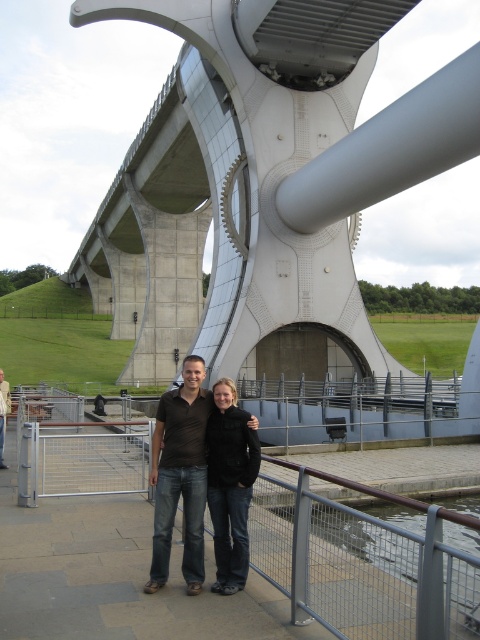
Is metallic gray bridge at center wider than black leather jacket at center?

Indeed, metallic gray bridge at center has a greater width compared to black leather jacket at center.

Who is more distant from viewer, (453, 122) or (247, 445)?

Positioned behind is point (453, 122).

Where is `metallic gray bridge at center`? Image resolution: width=480 pixels, height=640 pixels. metallic gray bridge at center is located at coordinates (x=265, y=176).

Between brown cotton shirt at center and brown shirt at center, which one has more height?

Standing taller between the two is brown cotton shirt at center.

Does brown cotton shirt at center have a lesser width compared to brown shirt at center?

Yes, brown cotton shirt at center is thinner than brown shirt at center.

This screenshot has width=480, height=640. I want to click on brown cotton shirt at center, so click(x=180, y=474).

Locate an element on the screen. This screenshot has width=480, height=640. brown cotton shirt at center is located at coordinates (180, 474).

Does black leather jacket at center appear on the left side of brown shirt at center?

Incorrect, black leather jacket at center is not on the left side of brown shirt at center.

What do you see at coordinates (229, 484) in the screenshot? The height and width of the screenshot is (640, 480). I see `black leather jacket at center` at bounding box center [229, 484].

Who is more distant from viewer, (224, 540) or (1, 444)?

Positioned behind is point (1, 444).

I want to click on black leather jacket at center, so click(x=229, y=484).